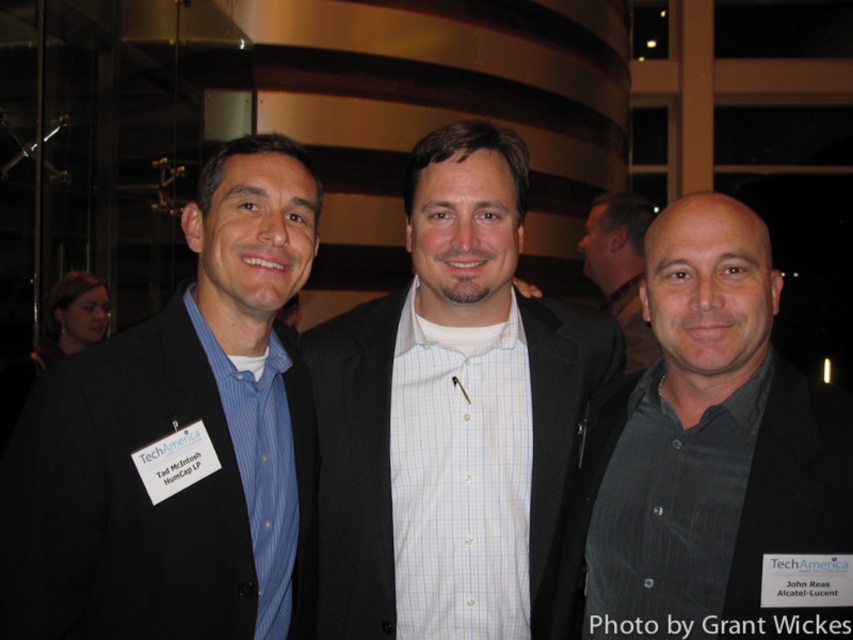
Which is in front, point (141, 342) or point (606, 204)?

Positioned in front is point (141, 342).

Does matte black suit at left have a lesser height compared to gray textured shirt at center?

In fact, matte black suit at left may be taller than gray textured shirt at center.

Identify the location of matte black suit at left. (178, 438).

Find the location of a particular element. matte black suit at left is located at coordinates (178, 438).

Is white checkered shirt at center taller than gray textured shirt at center?

Correct, white checkered shirt at center is much taller as gray textured shirt at center.

Does point (462, 609) come behind point (608, 227)?

No, (462, 609) is closer to viewer.

The width and height of the screenshot is (853, 640). Identify the location of white checkered shirt at center. (450, 412).

How much distance is there between gray pinstripe shirt at center and gray textured shirt at center?

The distance of gray pinstripe shirt at center from gray textured shirt at center is 7.86 feet.

Does gray pinstripe shirt at center have a greater height compared to gray textured shirt at center?

Indeed, gray pinstripe shirt at center has a greater height compared to gray textured shirt at center.

Is point (653, 560) behind point (614, 236)?

No.

Where is `gray pinstripe shirt at center`? Image resolution: width=853 pixels, height=640 pixels. gray pinstripe shirt at center is located at coordinates (717, 449).